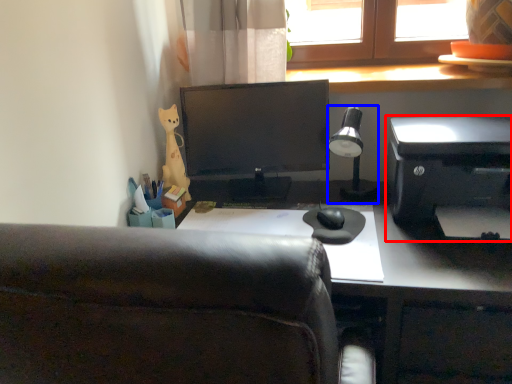
Question: Which of the following is the closest to the observer, printer (highlighted by a red box) or lamp (highlighted by a blue box)?

Choices:
 (A) printer
 (B) lamp

Answer: (A)